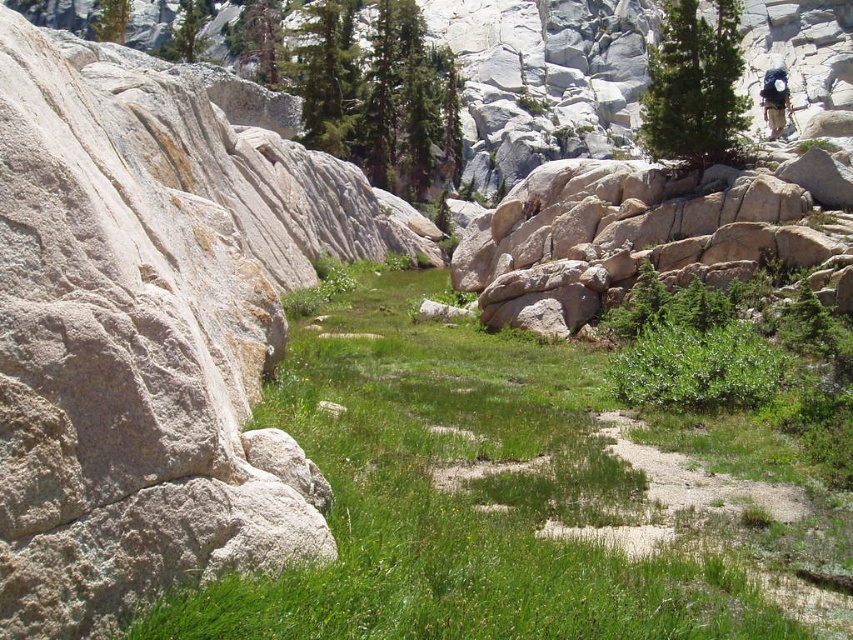
Question: Can you confirm if green grass at center is smaller than green textured pine tree at upper right?

Choices:
 (A) no
 (B) yes

Answer: (B)

Question: Which of these objects is positioned farthest from the smooth granite boulder at upper right?

Choices:
 (A) white rock at upper center
 (B) green leafy tree at upper center

Answer: (A)

Question: Does green grass at center appear under smooth granite boulder at upper right?

Choices:
 (A) yes
 (B) no

Answer: (A)

Question: Among these objects, which one is farthest from the camera?

Choices:
 (A) white rock at upper center
 (B) green textured pine tree at upper right
 (C) green leafy tree at upper center
 (D) dark blue backpack at upper right

Answer: (C)

Question: Which object appears farthest from the camera in this image?

Choices:
 (A) smooth granite boulder at upper right
 (B) green textured pine tree at upper right

Answer: (B)

Question: Is green grass at center bigger than green leafy tree at upper center?

Choices:
 (A) yes
 (B) no

Answer: (B)